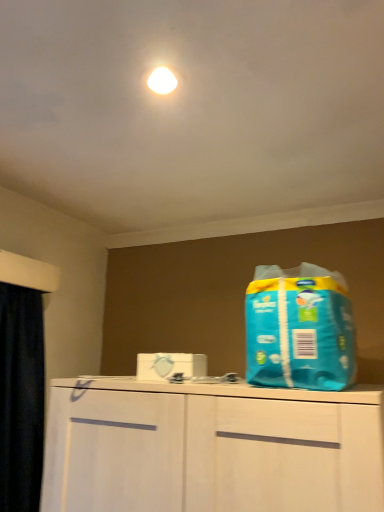
The height and width of the screenshot is (512, 384). What do you see at coordinates (21, 398) in the screenshot? I see `black fabric curtain at left` at bounding box center [21, 398].

In order to click on black fabric curtain at left in this screenshot , I will do `click(21, 398)`.

This screenshot has height=512, width=384. What do you see at coordinates (299, 329) in the screenshot?
I see `blue plastic bag at right` at bounding box center [299, 329].

Identify the location of blue plastic bag at right. Image resolution: width=384 pixels, height=512 pixels. (299, 329).

Where is `black fabric curtain at left`? The height and width of the screenshot is (512, 384). black fabric curtain at left is located at coordinates (21, 398).

Looking at this image, based on their positions, is blue plastic bag at right located to the left or right of black fabric curtain at left?

Based on their positions, blue plastic bag at right is located to the right of black fabric curtain at left.

Considering the relative positions of blue plastic bag at right and black fabric curtain at left in the image provided, is blue plastic bag at right behind black fabric curtain at left?

No, blue plastic bag at right is closer to the viewer.

Which is in front, point (258, 320) or point (4, 348)?

The point (258, 320) is closer to the camera.

From the image's perspective, does blue plastic bag at right appear lower than black fabric curtain at left?

Incorrect, from the image's perspective, blue plastic bag at right is higher than black fabric curtain at left.

From a real-world perspective, which object stands above the other?

blue plastic bag at right, from a real-world perspective.

Between blue plastic bag at right and black fabric curtain at left, which one has smaller width?

Thinner between the two is black fabric curtain at left.

Which of these two, blue plastic bag at right or black fabric curtain at left, stands taller?

With more height is black fabric curtain at left.

In the scene shown: Considering the relative sizes of blue plastic bag at right and black fabric curtain at left in the image provided, is blue plastic bag at right smaller than black fabric curtain at left?

Yes.

Is black fabric curtain at left completely or partially inside blue plastic bag at right?

Actually, black fabric curtain at left is outside blue plastic bag at right.

Would you consider blue plastic bag at right to be distant from black fabric curtain at left?

No, blue plastic bag at right is not far from black fabric curtain at left.

Is black fabric curtain at left at the back of blue plastic bag at right?

No.

You are a GUI agent. You are given a task and a screenshot of the screen. Output one action in this format:
    pyautogui.click(x=<x>, y=<y>)
    Task: Click on the curtain that appears behind the blue plastic bag at right
    
    Given the screenshot: What is the action you would take?
    pyautogui.click(x=21, y=398)

Between black fabric curtain at left and blue plastic bag at right, which one appears on the left side from the viewer's perspective?

black fabric curtain at left.

Is the position of black fabric curtain at left more distant than that of blue plastic bag at right?

Yes, it is behind blue plastic bag at right.

Is point (4, 460) farther from viewer compared to point (267, 306)?

That is True.

From the image's perspective, between black fabric curtain at left and blue plastic bag at right, which one is located above?

blue plastic bag at right is shown above in the image.

From a real-world perspective, which is physically below, black fabric curtain at left or blue plastic bag at right?

From a 3D spatial view, black fabric curtain at left is below.

Which of these two, black fabric curtain at left or blue plastic bag at right, is wider?

blue plastic bag at right.

Can you confirm if black fabric curtain at left is taller than blue plastic bag at right?

Yes.

Between black fabric curtain at left and blue plastic bag at right, which one has larger size?

black fabric curtain at left is bigger.

Is black fabric curtain at left completely or partially outside of blue plastic bag at right?

That's correct, black fabric curtain at left is outside of blue plastic bag at right.

Is black fabric curtain at left far from blue plastic bag at right?

Actually, black fabric curtain at left and blue plastic bag at right are a little close together.

Consider the image. Could you tell me if black fabric curtain at left is turned towards blue plastic bag at right?

Yes, black fabric curtain at left is facing blue plastic bag at right.

What's the angular difference between black fabric curtain at left and blue plastic bag at right's facing directions?

There is a 90-degree angle between the facing directions of black fabric curtain at left and blue plastic bag at right.

Consider the image. How far apart are black fabric curtain at left and blue plastic bag at right?

black fabric curtain at left is 31.38 inches away from blue plastic bag at right.

Locate an element on the screen. cleaning product that appears on the right of black fabric curtain at left is located at coordinates (x=299, y=329).

Image resolution: width=384 pixels, height=512 pixels. Identify the location of curtain that is behind the blue plastic bag at right. (21, 398).

Find the location of a particular element. cleaning product on the right side of black fabric curtain at left is located at coordinates (299, 329).